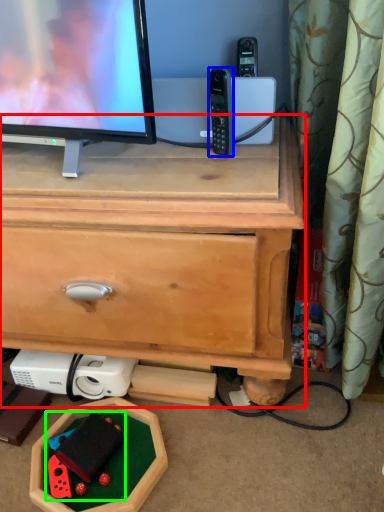
Question: Which object is the closest to the chest of drawers (highlighted by a red box)? Choose among these: gadget (highlighted by a blue box) or toy (highlighted by a green box).

Choices:
 (A) gadget
 (B) toy

Answer: (A)